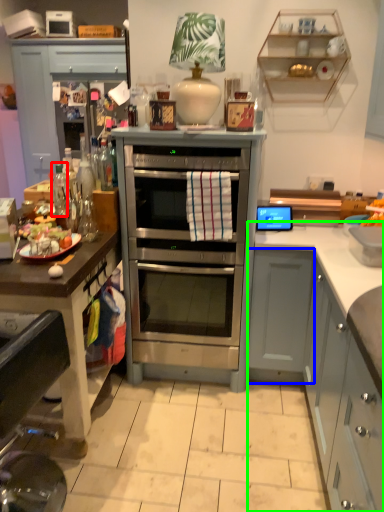
Question: Which is nearer to the bottle (highlighted by a red box)? cabinetry (highlighted by a blue box) or cabinetry (highlighted by a green box).

Choices:
 (A) cabinetry
 (B) cabinetry

Answer: (A)